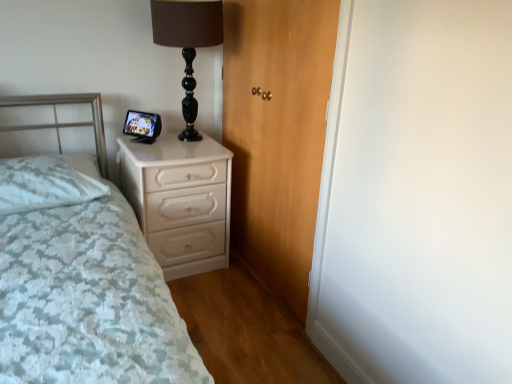
Question: Is white glossy chest of drawers at center oriented away from black glass table lamp at upper center?

Choices:
 (A) no
 (B) yes

Answer: (A)

Question: Is white glossy chest of drawers at center positioned beyond the bounds of black glass table lamp at upper center?

Choices:
 (A) yes
 (B) no

Answer: (A)

Question: Does white glossy chest of drawers at center have a smaller size compared to black glass table lamp at upper center?

Choices:
 (A) yes
 (B) no

Answer: (B)

Question: From the image's perspective, is white glossy chest of drawers at center below black glass table lamp at upper center?

Choices:
 (A) yes
 (B) no

Answer: (A)

Question: From a real-world perspective, is white glossy chest of drawers at center physically below black glass table lamp at upper center?

Choices:
 (A) no
 (B) yes

Answer: (B)

Question: Is point (53, 165) positioned closer to the camera than point (193, 77)?

Choices:
 (A) closer
 (B) farther

Answer: (A)

Question: From a real-world perspective, is white textured pillow at left physically located above or below black glass table lamp at upper center?

Choices:
 (A) below
 (B) above

Answer: (A)

Question: Do you think white textured pillow at left is within black glass table lamp at upper center, or outside of it?

Choices:
 (A) inside
 (B) outside

Answer: (B)

Question: From the image's perspective, is white textured pillow at left positioned above or below black glass table lamp at upper center?

Choices:
 (A) below
 (B) above

Answer: (A)

Question: Is white glossy chest of drawers at center bigger or smaller than white textured pillow at left?

Choices:
 (A) big
 (B) small

Answer: (A)

Question: Considering the positions of white glossy chest of drawers at center and white textured pillow at left in the image, is white glossy chest of drawers at center wider or thinner than white textured pillow at left?

Choices:
 (A) thin
 (B) wide

Answer: (B)

Question: Considering the positions of point (210, 263) and point (20, 163), is point (210, 263) closer or farther from the camera than point (20, 163)?

Choices:
 (A) closer
 (B) farther

Answer: (B)

Question: From a real-world perspective, is white glossy chest of drawers at center positioned above or below white textured pillow at left?

Choices:
 (A) above
 (B) below

Answer: (B)

Question: Choose the correct answer: Is white textured pillow at left inside wooden door at center or outside it?

Choices:
 (A) outside
 (B) inside

Answer: (A)

Question: Based on their positions, is white textured pillow at left located to the left or right of wooden door at center?

Choices:
 (A) left
 (B) right

Answer: (A)